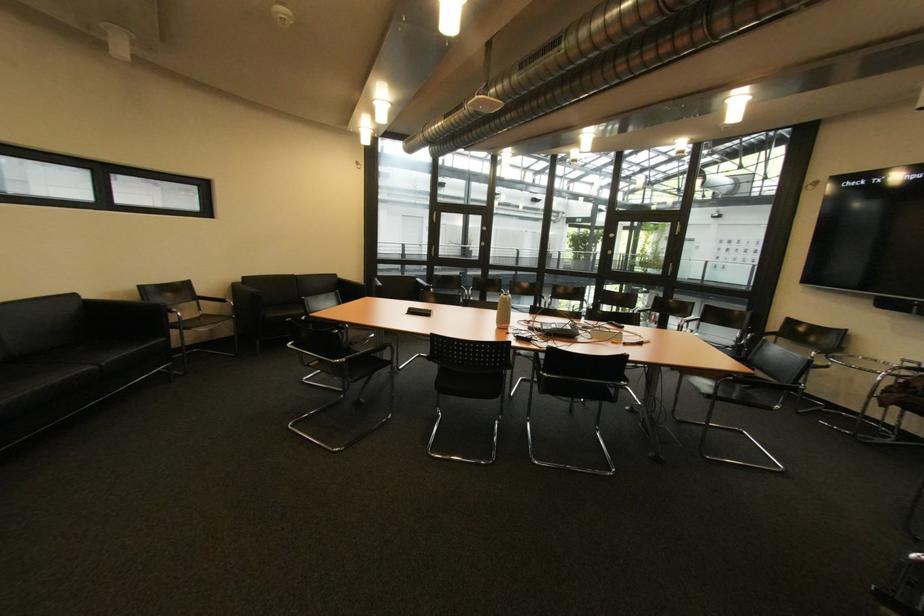
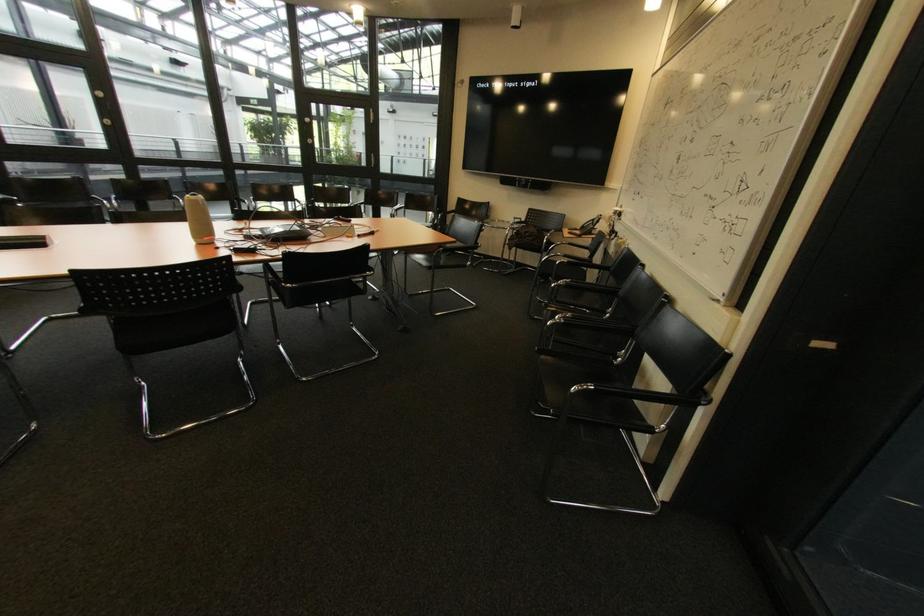
The point at (508, 328) is marked in the first image. Where is the corresponding point in the second image?

(210, 243)